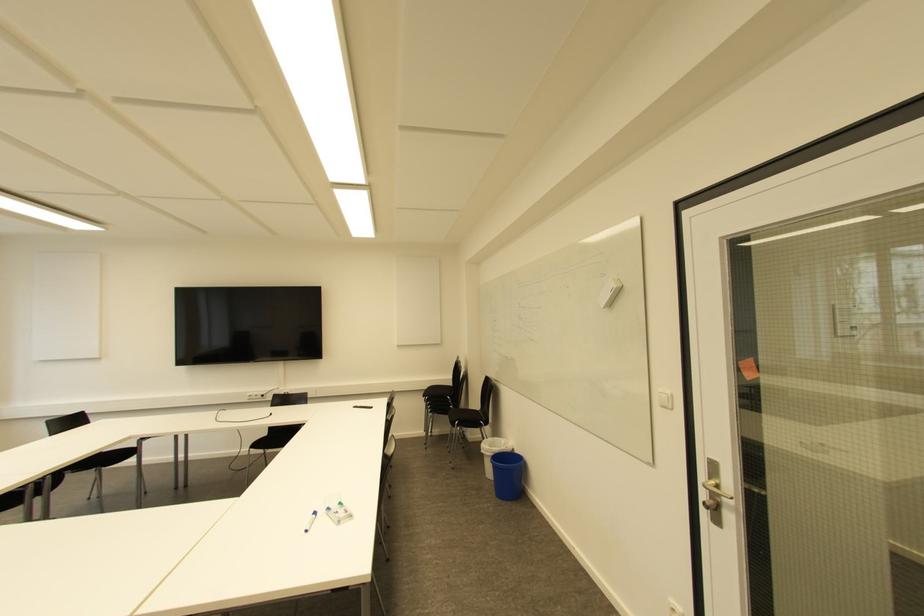
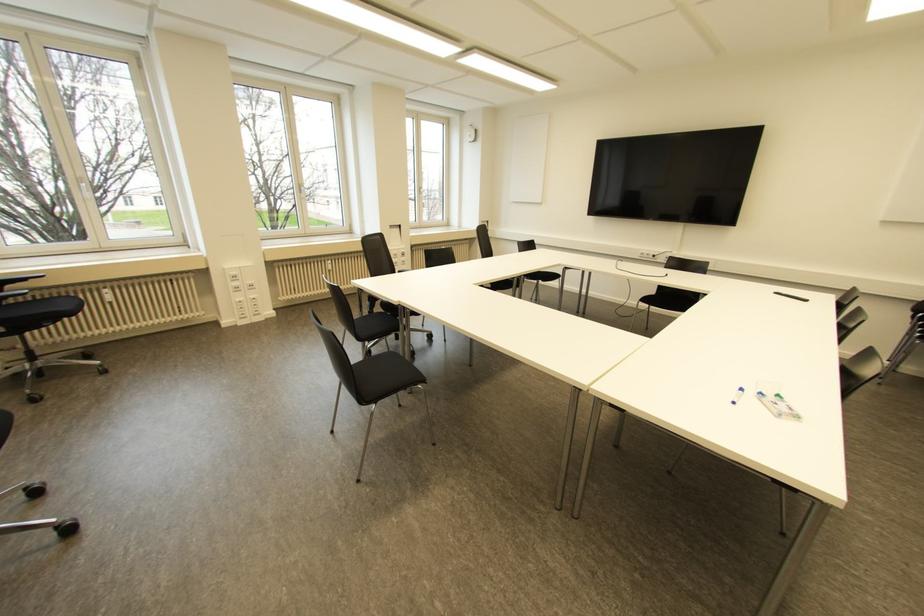
Based on the photo, the images are taken continuously from a first-person perspective. In which direction is your viewpoint rotating?

The camera rotated toward left-down.